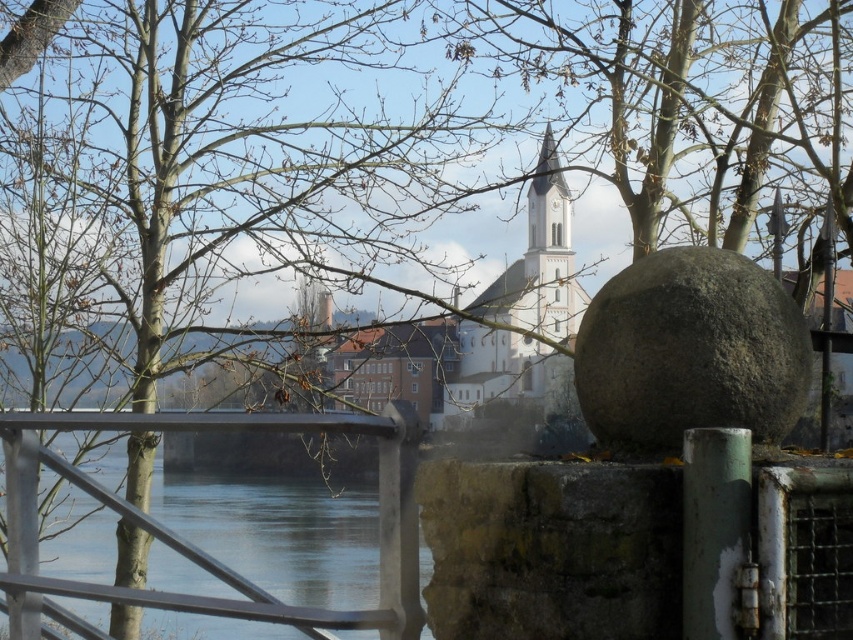
You are an architect designing a new garden path that must avoid the area directly under the brown leafless tree at upper left. Given that the tree is located at coordinates point 0.856, 0.230, where should you place the path to ensure it stays clear of the tree?

The brown leafless tree at upper left is located at point [195,547], so the path should be placed away from this coordinate to avoid the area directly under it.

You are an artist planning to paint the riverside scene. You need to decide which object between the gray rough stone sphere at center and the smooth concrete river at center would be easier to sketch quickly. Based on their shapes, which one requires fewer lines to outline?

The smooth concrete river at center has a simpler shape with fewer contours compared to the gray rough stone sphere at center, which has a more irregular and textured surface. Therefore, the smooth concrete river at center would be easier to sketch quickly with fewer lines.